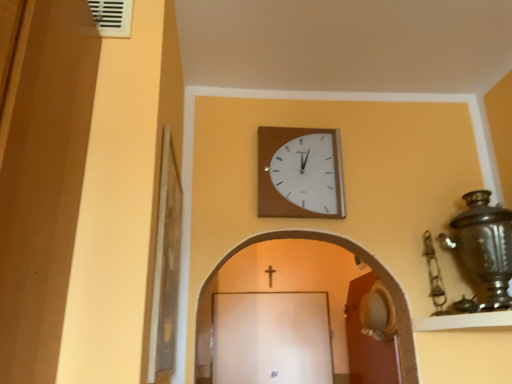
Question: Considering the relative positions of wooden wall clock at upper center and brown wooden door at lower right in the image provided, is wooden wall clock at upper center to the right of brown wooden door at lower right from the viewer's perspective?

Choices:
 (A) yes
 (B) no

Answer: (B)

Question: Is wooden wall clock at upper center facing towards brown wooden door at lower right?

Choices:
 (A) yes
 (B) no

Answer: (B)

Question: From a real-world perspective, is wooden wall clock at upper center located beneath brown wooden door at lower right?

Choices:
 (A) yes
 (B) no

Answer: (B)

Question: Is wooden wall clock at upper center not near brown wooden door at lower right?

Choices:
 (A) yes
 (B) no

Answer: (A)

Question: Is wooden wall clock at upper center smaller than brown wooden door at lower right?

Choices:
 (A) yes
 (B) no

Answer: (A)

Question: Is brown wooden door at lower right inside wooden wall clock at upper center?

Choices:
 (A) no
 (B) yes

Answer: (A)

Question: Is white plastic vent at upper left surrounded by wooden wall clock at upper center?

Choices:
 (A) yes
 (B) no

Answer: (B)

Question: Is wooden wall clock at upper center not within white plastic vent at upper left?

Choices:
 (A) no
 (B) yes

Answer: (B)

Question: Is wooden wall clock at upper center smaller than white plastic vent at upper left?

Choices:
 (A) no
 (B) yes

Answer: (A)

Question: Can you confirm if wooden wall clock at upper center is positioned to the right of white plastic vent at upper left?

Choices:
 (A) yes
 (B) no

Answer: (A)

Question: Is wooden wall clock at upper center to the left of white plastic vent at upper left from the viewer's perspective?

Choices:
 (A) no
 (B) yes

Answer: (A)

Question: Is wooden wall clock at upper center not close to white plastic vent at upper left?

Choices:
 (A) no
 (B) yes

Answer: (A)

Question: Does wooden wall clock at upper center come behind gold metallic crucifix at center?

Choices:
 (A) no
 (B) yes

Answer: (A)